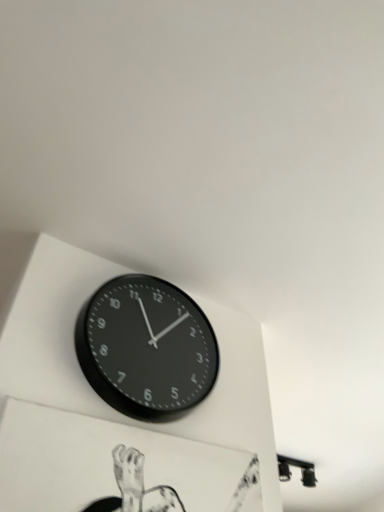
The image size is (384, 512). In order to click on black matte clock at upper center in this screenshot , I will do `click(146, 348)`.

What is the approximate width of black matte clock at upper center?

6.80 centimeters.

This screenshot has width=384, height=512. What do you see at coordinates (146, 348) in the screenshot?
I see `black matte clock at upper center` at bounding box center [146, 348].

You are a GUI agent. You are given a task and a screenshot of the screen. Output one action in this format:
    pyautogui.click(x=<x>, y=<y>)
    Task: Click on the black matte clock at upper center
    The image size is (384, 512).
    Given the screenshot: What is the action you would take?
    pyautogui.click(x=146, y=348)